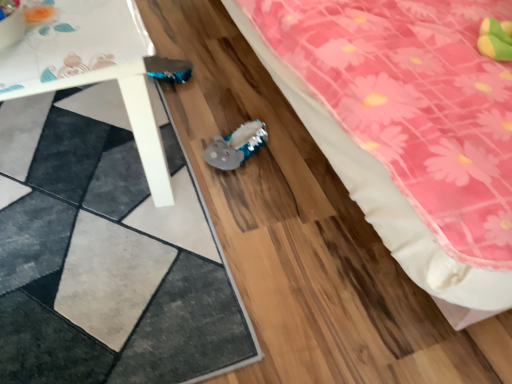
Question: Does textured gray rug at lower left lie behind fuzzy fabric plushie at center?

Choices:
 (A) yes
 (B) no

Answer: (B)

Question: Is fuzzy fabric plushie at center at the back of textured gray rug at lower left?

Choices:
 (A) yes
 (B) no

Answer: (B)

Question: Is textured gray rug at lower left with fuzzy fabric plushie at center?

Choices:
 (A) no
 (B) yes

Answer: (A)

Question: Is textured gray rug at lower left wider than fuzzy fabric plushie at center?

Choices:
 (A) no
 (B) yes

Answer: (B)

Question: Can you confirm if textured gray rug at lower left is positioned to the left of fuzzy fabric plushie at center?

Choices:
 (A) no
 (B) yes

Answer: (B)

Question: Is textured gray rug at lower left smaller than fuzzy fabric plushie at center?

Choices:
 (A) yes
 (B) no

Answer: (B)

Question: Is white plastic table at lower left a part of pink fabric bed at lower right?

Choices:
 (A) yes
 (B) no

Answer: (B)

Question: Is pink fabric bed at lower right further to camera compared to white plastic table at lower left?

Choices:
 (A) no
 (B) yes

Answer: (A)

Question: Could you tell me if pink fabric bed at lower right is turned towards white plastic table at lower left?

Choices:
 (A) no
 (B) yes

Answer: (B)

Question: From the image's perspective, is pink fabric bed at lower right located beneath white plastic table at lower left?

Choices:
 (A) yes
 (B) no

Answer: (B)

Question: Is pink fabric bed at lower right beside white plastic table at lower left?

Choices:
 (A) yes
 (B) no

Answer: (B)

Question: Is pink fabric bed at lower right facing away from white plastic table at lower left?

Choices:
 (A) no
 (B) yes

Answer: (A)

Question: Considering the relative positions of pink fabric bed at lower right and textured gray rug at lower left in the image provided, is pink fabric bed at lower right behind textured gray rug at lower left?

Choices:
 (A) yes
 (B) no

Answer: (B)